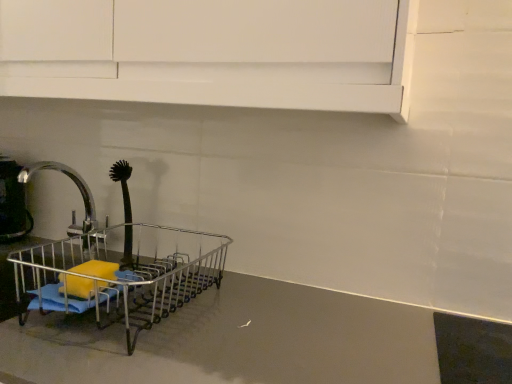
At what (x,y) coordinates should I click in order to perform the action: click on free spot below metallic silver dish rack at left (from a real-world perspective). Please return your answer as a coordinate pair (x, y). This screenshot has width=512, height=384. Looking at the image, I should click on [156, 307].